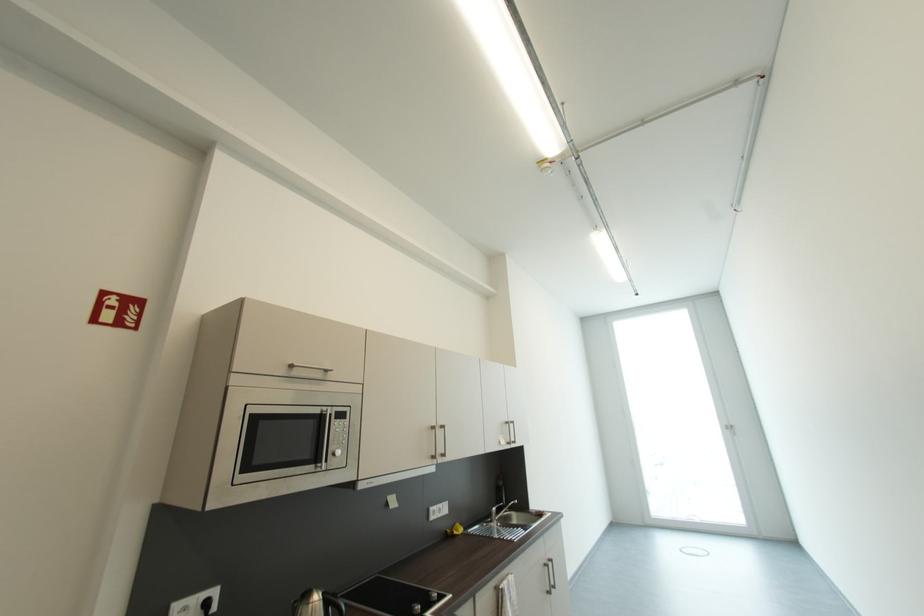
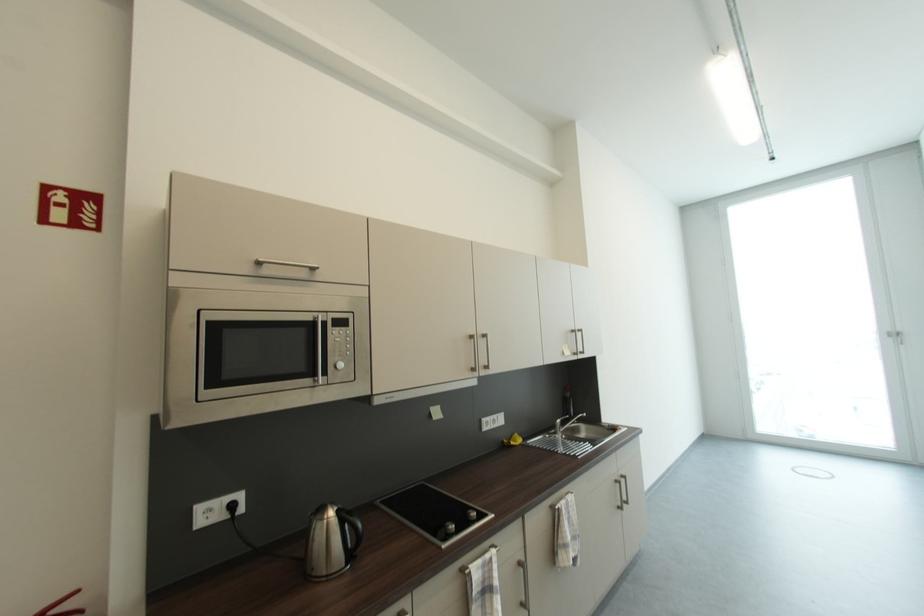
Question: How did the camera likely rotate?

Choices:
 (A) Left
 (B) Right
 (C) Up
 (D) Down

Answer: (D)